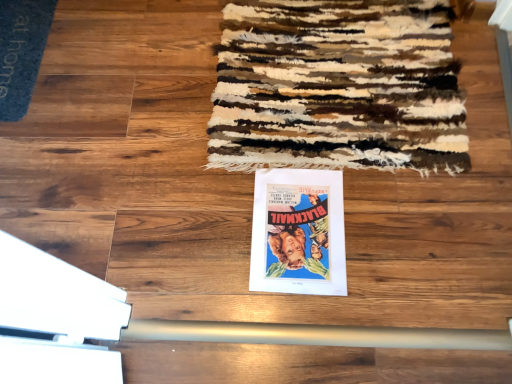
Question: Is blue carpet at upper left further to the viewer compared to matte paper poster at center?

Choices:
 (A) yes
 (B) no

Answer: (A)

Question: Considering the relative sizes of blue carpet at upper left and matte paper poster at center in the image provided, is blue carpet at upper left bigger than matte paper poster at center?

Choices:
 (A) yes
 (B) no

Answer: (A)

Question: Does blue carpet at upper left have a smaller size compared to matte paper poster at center?

Choices:
 (A) yes
 (B) no

Answer: (B)

Question: Is blue carpet at upper left oriented towards matte paper poster at center?

Choices:
 (A) yes
 (B) no

Answer: (A)

Question: Does blue carpet at upper left have a greater width compared to matte paper poster at center?

Choices:
 (A) yes
 (B) no

Answer: (B)

Question: Considering the positions of point (264, 261) and point (12, 6), is point (264, 261) closer or farther from the camera than point (12, 6)?

Choices:
 (A) closer
 (B) farther

Answer: (A)

Question: In the image, is matte paper poster at center positioned in front of or behind blue carpet at upper left?

Choices:
 (A) front
 (B) behind

Answer: (A)

Question: Would you say matte paper poster at center is inside or outside blue carpet at upper left?

Choices:
 (A) outside
 (B) inside

Answer: (A)

Question: Considering the positions of matte paper poster at center and blue carpet at upper left in the image, is matte paper poster at center bigger or smaller than blue carpet at upper left?

Choices:
 (A) big
 (B) small

Answer: (B)

Question: From the image's perspective, relative to matte paper poster at center, is blue carpet at upper left above or below?

Choices:
 (A) above
 (B) below

Answer: (A)

Question: Do you think blue carpet at upper left is within matte paper poster at center, or outside of it?

Choices:
 (A) inside
 (B) outside

Answer: (B)

Question: From a real-world perspective, is blue carpet at upper left positioned above or below matte paper poster at center?

Choices:
 (A) below
 (B) above

Answer: (B)

Question: Is blue carpet at upper left in front of or behind matte paper poster at center in the image?

Choices:
 (A) front
 (B) behind

Answer: (B)

Question: In the image, is matte paper poster at center positioned in front of or behind textured woolen mat at upper center?

Choices:
 (A) behind
 (B) front

Answer: (B)

Question: Is point (343, 236) positioned closer to the camera than point (260, 155)?

Choices:
 (A) closer
 (B) farther

Answer: (A)